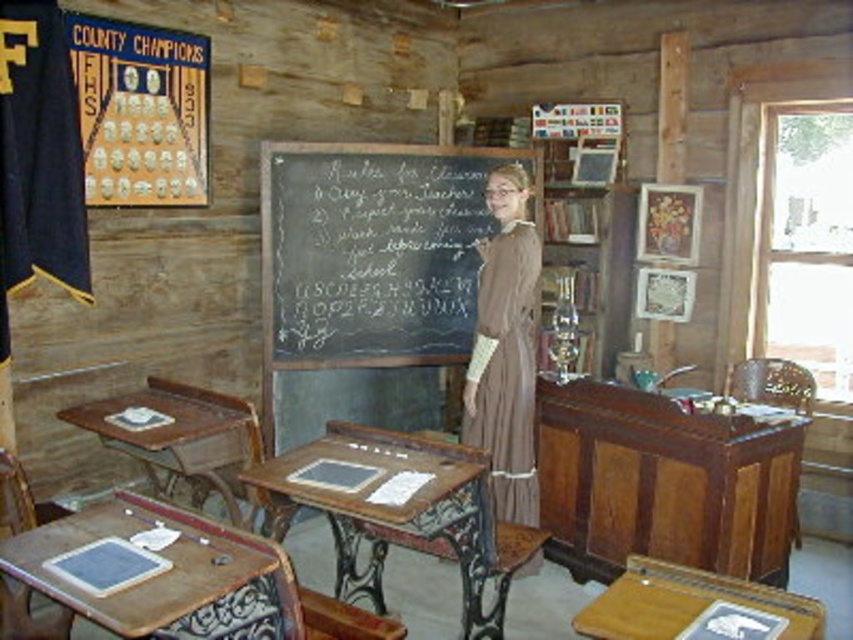
Does point (45, 586) lie behind point (523, 337)?

No, (45, 586) is in front of (523, 337).

Is wooden desk at lower left taller than brown cotton dress at center?

No.

The image size is (853, 640). I want to click on wooden desk at lower left, so click(157, 572).

Identify the location of wooden desk at lower left. (157, 572).

Between brown cotton dress at center and wooden chair at right, which one appears on the right side from the viewer's perspective?

Positioned to the right is wooden chair at right.

Does brown cotton dress at center have a lesser width compared to wooden chair at right?

Yes.

This screenshot has width=853, height=640. What do you see at coordinates (505, 348) in the screenshot?
I see `brown cotton dress at center` at bounding box center [505, 348].

Where is `brown cotton dress at center`? brown cotton dress at center is located at coordinates (505, 348).

Who is more forward, [233,474] or [6,497]?

Point [6,497] is more forward.

Is wooden desk at left below wooden chair at lower left?

No, wooden desk at left is not below wooden chair at lower left.

The image size is (853, 640). What are the coordinates of `wooden desk at left` in the screenshot? It's located at coord(180,436).